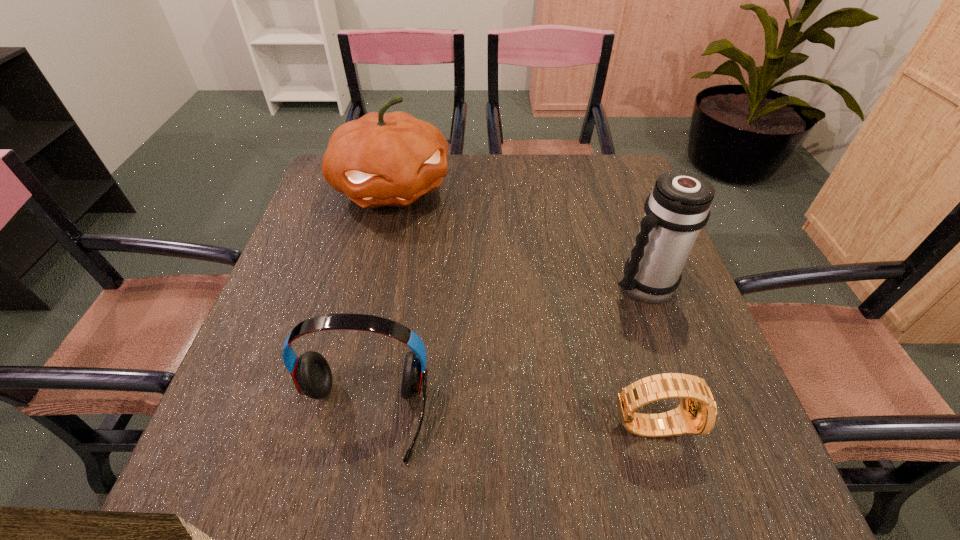
Where is `the second shortest object`? This screenshot has height=540, width=960. the second shortest object is located at coordinates (311, 373).

Where is `the shortest object`? This screenshot has width=960, height=540. the shortest object is located at coordinates (697, 413).

Locate an element on the screen. the third nearest object is located at coordinates (678, 207).

Where is `the farthest object`? The height and width of the screenshot is (540, 960). the farthest object is located at coordinates (382, 159).

Find the location of a particular element. The image size is (960, 540). vacant area situated on the face of the shortest object is located at coordinates (742, 424).

Identify the location of free region located on the side with the handle of the second farthest object. This screenshot has width=960, height=540. (542, 366).

Find the location of `vacant space located 0.260m on the side with the handle of the second farthest object`. vacant space located 0.260m on the side with the handle of the second farthest object is located at coordinates pos(542,366).

Find the location of a particular element. This screenshot has width=960, height=540. vacant space located 0.190m on the side with the handle of the second farthest object is located at coordinates (566, 346).

I want to click on vacant space positioned on the front face of the pumpkin, so click(x=471, y=322).

Find the location of a particular element. This screenshot has width=960, height=540. free region located 0.060m on the front face of the pumpkin is located at coordinates (420, 235).